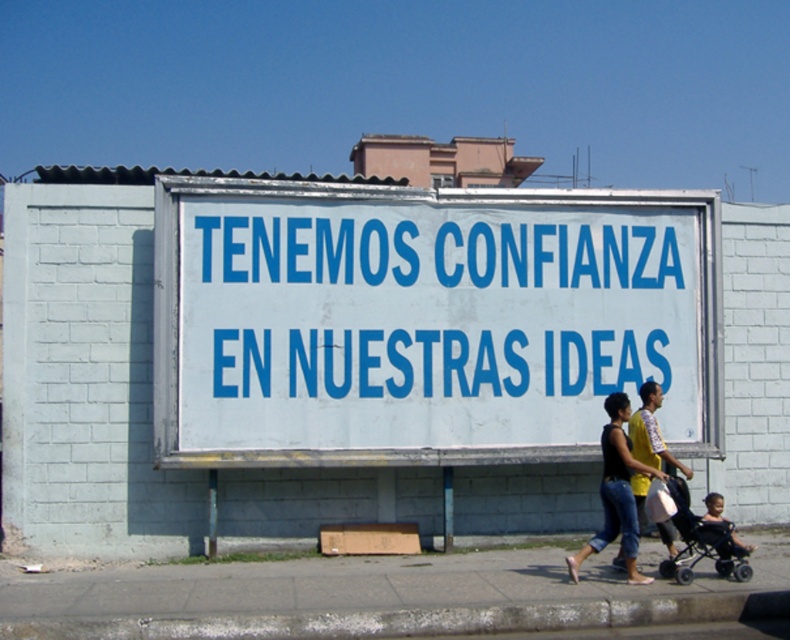
Question: Can you confirm if white paperboard sign at center is thinner than black plastic baby carriage at lower right?

Choices:
 (A) yes
 (B) no

Answer: (B)

Question: Is white paperboard sign at center to the right of black plastic baby carriage at lower right from the viewer's perspective?

Choices:
 (A) yes
 (B) no

Answer: (B)

Question: Which is farther from the black denim jeans at lower right?

Choices:
 (A) black plastic baby carriage at lower right
 (B) white paperboard sign at center

Answer: (B)

Question: Is black denim jeans at lower right closer to the viewer compared to dark skin baby in stroller at lower right?

Choices:
 (A) yes
 (B) no

Answer: (A)

Question: Which point is closer to the camera?

Choices:
 (A) black denim jeans at lower right
 (B) black plastic baby carriage at lower right
 (C) dark skin baby in stroller at lower right
 (D) white paperboard sign at center

Answer: (A)

Question: Which object is positioned farthest from the black denim jeans at lower right?

Choices:
 (A) dark skin baby in stroller at lower right
 (B) black plastic baby carriage at lower right
 (C) white paperboard sign at center

Answer: (C)